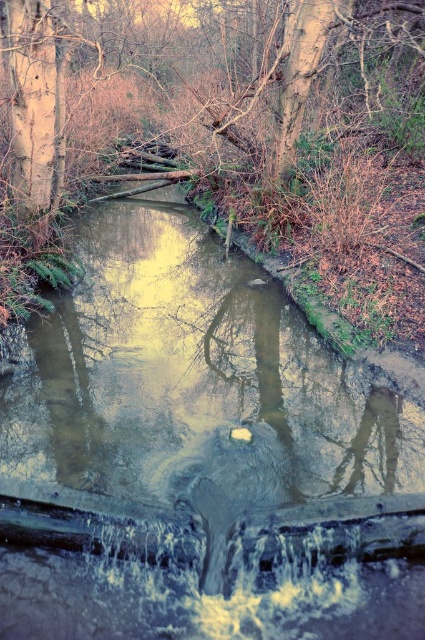
You are standing at the edge of the stream in the forest scene and see two points marked in the image. Which of the two points, point (379, 445) or point (277, 154), is closer to you?

Point (379, 445) is closer to the viewer than point (277, 154).

You are standing at the edge of the stream and want to cross to the other side. There is a brown concrete at center and a brown wood tree at upper center in your view. Which object is closer to you, making it the first thing you would encounter if you walk straight ahead?

The brown concrete at center is closer to you and would be the first thing encountered because it is positioned in front of the brown wood tree at upper center.

You are standing at the edge of the stream and need to place a 5 meter long wooden bridge between the brown concrete at center and the brown wood tree at upper center. Will the bridge fit between them?

The brown concrete at center is 7.05 meters away from the brown wood tree at upper center. Since the bridge is 5 meters long, it will not be long enough to span the distance between the brown concrete at center and the brown wood tree at upper center.